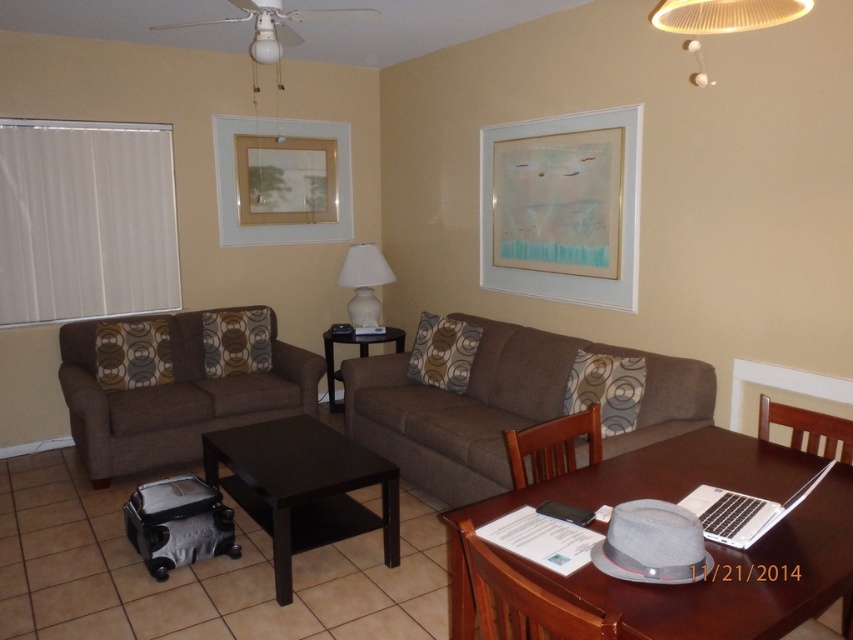
Question: Which point is farther from the camera taking this photo?

Choices:
 (A) (595, 248)
 (B) (396, 452)
 (C) (698, 38)

Answer: (B)

Question: Is matte brown armchair at lower center positioned at the back of black glossy table at center?

Choices:
 (A) no
 (B) yes

Answer: (A)

Question: Can you confirm if matte gold picture frame at upper center is wider than matte brown armchair at lower center?

Choices:
 (A) yes
 (B) no

Answer: (A)

Question: Among these objects, which one is farthest from the camera?

Choices:
 (A) brown fabric couch at center
 (B) metallic silver laptop at lower right
 (C) gold-framed artwork at upper center

Answer: (C)

Question: Is gold-framed artwork at upper center further to camera compared to silver metallic laptop at lower right?

Choices:
 (A) yes
 (B) no

Answer: (A)

Question: Which point is farther from the camera taking this photo?

Choices:
 (A) (727, 493)
 (B) (230, 234)
 (C) (582, 154)
 (D) (254, 349)

Answer: (B)